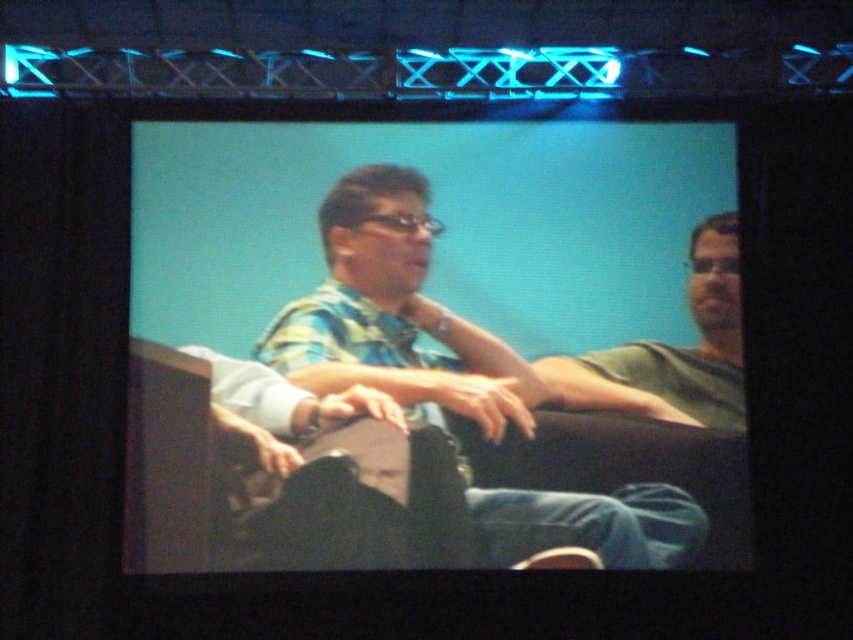
Is multicolored fabric shirt at center shorter than green matte shirt at right?

Incorrect, multicolored fabric shirt at center's height does not fall short of green matte shirt at right's.

Between multicolored fabric shirt at center and green matte shirt at right, which one is positioned higher?

green matte shirt at right is higher up.

Where is `multicolored fabric shirt at center`? This screenshot has height=640, width=853. multicolored fabric shirt at center is located at coordinates (393, 316).